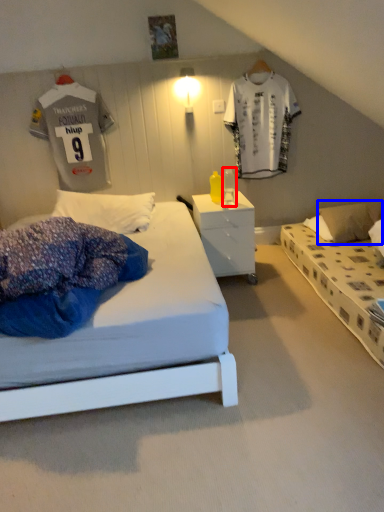
Question: Which point is closer to the camera, table lamp (highlighted by a red box) or pillow (highlighted by a blue box)?

Choices:
 (A) table lamp
 (B) pillow

Answer: (A)